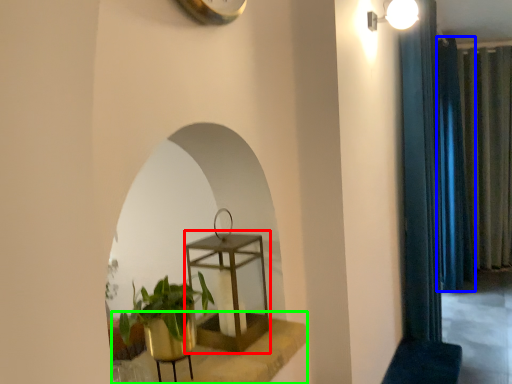
Question: Considering the real-world distances, which object is farthest from round table (highlighted by a red box)? curtain (highlighted by a blue box) or window sill (highlighted by a green box)?

Choices:
 (A) curtain
 (B) window sill

Answer: (A)